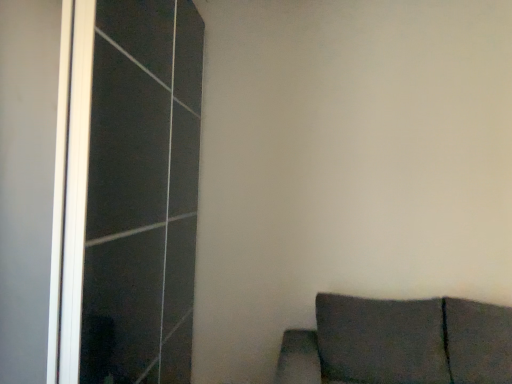
Based on the photo, what is the approximate height of dark fabric couch at lower right?

It is 65.72 centimeters.

Find the location of a particular element. This screenshot has width=512, height=384. dark fabric couch at lower right is located at coordinates (400, 343).

The width and height of the screenshot is (512, 384). Describe the element at coordinates (400, 343) in the screenshot. I see `dark fabric couch at lower right` at that location.

Measure the distance between dark fabric couch at lower right and camera.

dark fabric couch at lower right and camera are 6.68 feet apart.

What do you see at coordinates (131, 191) in the screenshot?
I see `transparent glass screen door at left` at bounding box center [131, 191].

Locate an element on the screen. This screenshot has width=512, height=384. transparent glass screen door at left is located at coordinates (131, 191).

What is the approximate width of transparent glass screen door at left?

22.85 inches.

At what (x,y) coordinates should I click in order to perform the action: click on dark fabric couch at lower right. Please return your answer as a coordinate pair (x, y). Looking at the image, I should click on (400, 343).

Is transparent glass screen door at left to the right of dark fabric couch at lower right from the viewer's perspective?

No.

Based on the photo, in the image, is transparent glass screen door at left positioned in front of or behind dark fabric couch at lower right?

transparent glass screen door at left is positioned farther from the viewer than dark fabric couch at lower right.

Is point (159, 202) positioned in front of point (447, 373)?

Yes, it is.

From the image's perspective, between transparent glass screen door at left and dark fabric couch at lower right, who is located below?

From the image's view, dark fabric couch at lower right is below.

From a real-world perspective, is transparent glass screen door at left on dark fabric couch at lower right?

Indeed, from a real-world perspective, transparent glass screen door at left stands above dark fabric couch at lower right.

From the picture: Considering the sizes of objects transparent glass screen door at left and dark fabric couch at lower right in the image provided, who is thinner, transparent glass screen door at left or dark fabric couch at lower right?

transparent glass screen door at left is thinner.

Based on the photo, between transparent glass screen door at left and dark fabric couch at lower right, which one has less height?

dark fabric couch at lower right.

Does transparent glass screen door at left have a larger size compared to dark fabric couch at lower right?

Indeed, transparent glass screen door at left has a larger size compared to dark fabric couch at lower right.

Would you say transparent glass screen door at left is inside or outside dark fabric couch at lower right?

transparent glass screen door at left is not inside dark fabric couch at lower right, it's outside.

Is transparent glass screen door at left in contact with dark fabric couch at lower right?

There is a gap between transparent glass screen door at left and dark fabric couch at lower right.

Is dark fabric couch at lower right at the back of transparent glass screen door at left?

transparent glass screen door at left is not turned away from dark fabric couch at lower right.

Find the location of a particular element. screen door on the left side of dark fabric couch at lower right is located at coordinates (131, 191).

Considering the relative positions of dark fabric couch at lower right and transparent glass screen door at left in the image provided, is dark fabric couch at lower right to the left or to the right of transparent glass screen door at left?

dark fabric couch at lower right is positioned on transparent glass screen door at left's right side.

Considering their positions, is dark fabric couch at lower right located in front of or behind transparent glass screen door at left?

dark fabric couch at lower right is in front of transparent glass screen door at left.

Which is in front, point (285, 336) or point (194, 135)?

The point (285, 336) is closer.

From the image's perspective, is dark fabric couch at lower right located beneath transparent glass screen door at left?

Yes, from the image's perspective, dark fabric couch at lower right is beneath transparent glass screen door at left.

From a real-world perspective, between dark fabric couch at lower right and transparent glass screen door at left, who is vertically higher?

In real-world perspective, transparent glass screen door at left is above.

Can you confirm if dark fabric couch at lower right is thinner than transparent glass screen door at left?

No.

Does dark fabric couch at lower right have a greater height compared to transparent glass screen door at left?

No.

Looking at the image, does dark fabric couch at lower right seem bigger or smaller compared to transparent glass screen door at left?

Considering their sizes, dark fabric couch at lower right takes up less space than transparent glass screen door at left.

Is dark fabric couch at lower right outside of transparent glass screen door at left?

Yes, dark fabric couch at lower right is not within transparent glass screen door at left.

Is dark fabric couch at lower right not close to transparent glass screen door at left?

Yes, dark fabric couch at lower right and transparent glass screen door at left are located far from each other.

Is dark fabric couch at lower right oriented towards transparent glass screen door at left?

No, dark fabric couch at lower right is not turned towards transparent glass screen door at left.

How different are the orientations of dark fabric couch at lower right and transparent glass screen door at left in degrees?

91 degrees.

At what (x,y) coordinates should I click in order to perform the action: click on screen door above the dark fabric couch at lower right (from the image's perspective). Please return your answer as a coordinate pair (x, y). This screenshot has height=384, width=512. Looking at the image, I should click on (131, 191).

Image resolution: width=512 pixels, height=384 pixels. There is a dark fabric couch at lower right. In order to click on screen door above it (from a real-world perspective) in this screenshot , I will do `click(131, 191)`.

Find the location of a particular element. This screenshot has height=384, width=512. screen door that is on the left side of dark fabric couch at lower right is located at coordinates (131, 191).